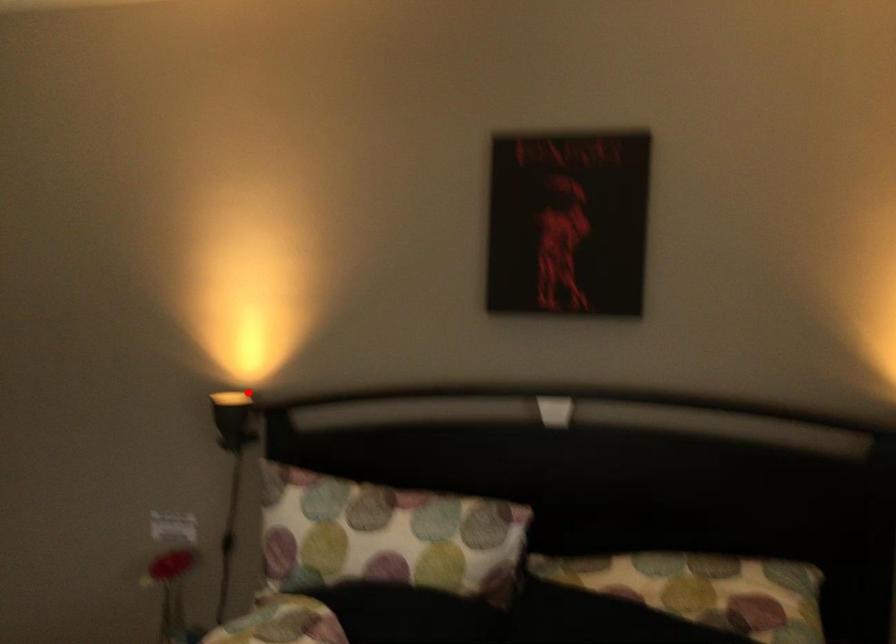
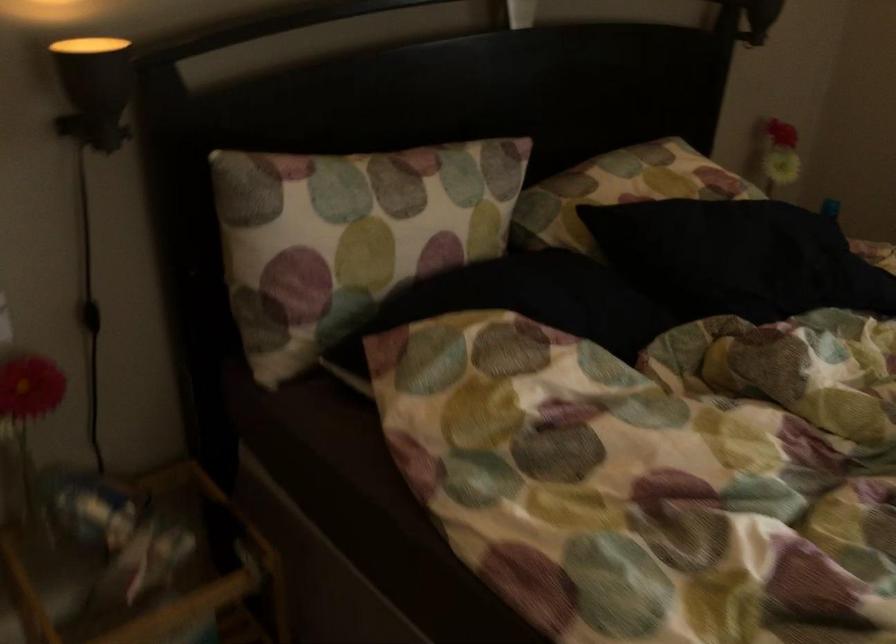
Question: A red point is marked in image1. In image2, is the corresponding 3D point closer to the camera or farther? Reply with the corresponding letter.

Choices:
 (A) The corresponding 3D point is closer.
 (B) The corresponding 3D point is farther.

Answer: (A)